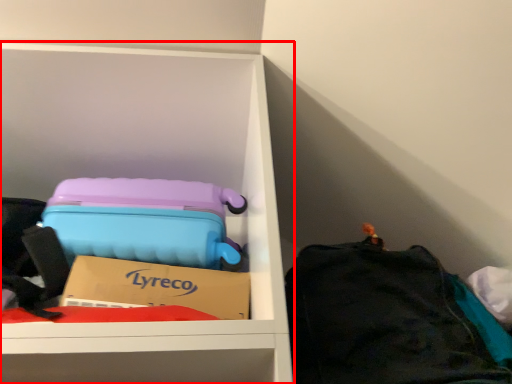
Question: From the image's perspective, what is the correct spatial positioning of furniture (annotated by the red box) in reference to luggage and bags?

Choices:
 (A) above
 (B) below

Answer: (A)